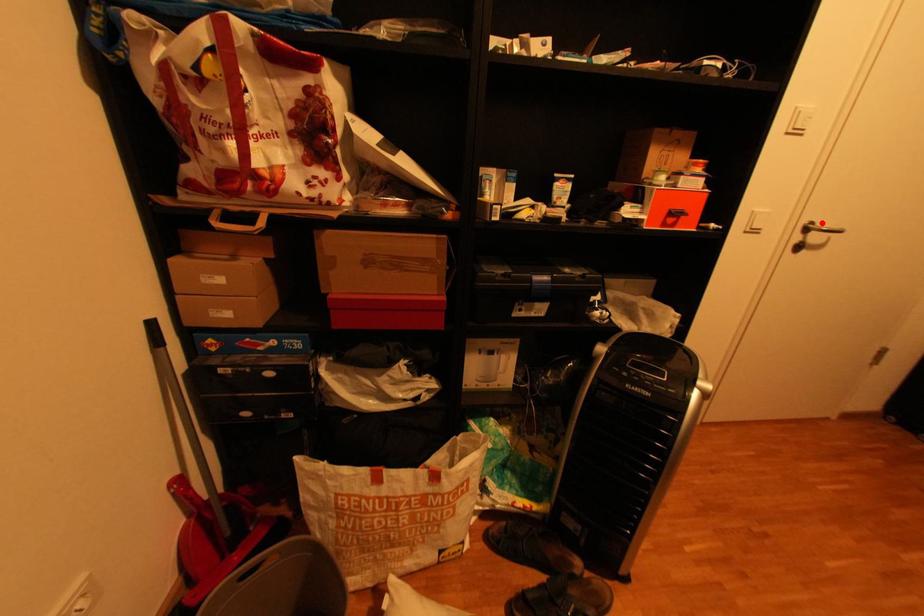
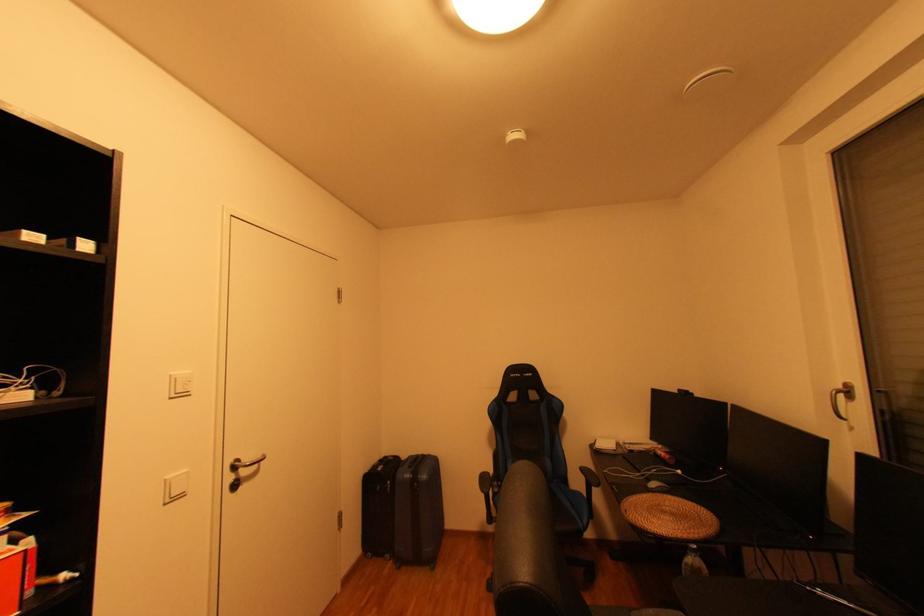
The point at the highlighted location is marked in the first image. Where is the corresponding point in the second image?

(247, 461)